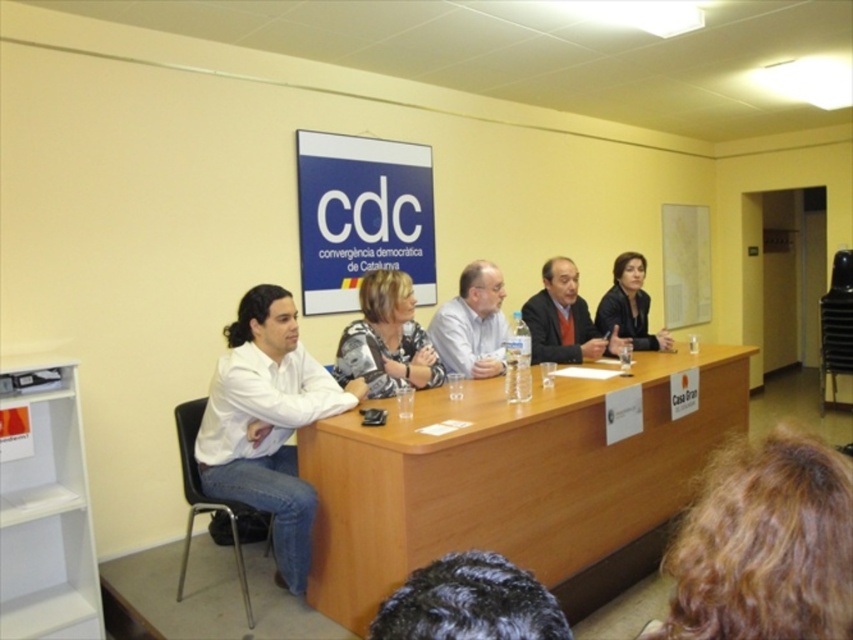
Question: Is dark curly hair at center to the right of patterned fabric blouse at center from the viewer's perspective?

Choices:
 (A) yes
 (B) no

Answer: (A)

Question: Which point is closer to the camera?

Choices:
 (A) dark curly hair at center
 (B) blonde curly hair at lower right
 (C) light brown wood table at center
 (D) black leather jacket at center

Answer: (A)

Question: Which object is closer to the camera taking this photo?

Choices:
 (A) black leather jacket at center
 (B) dark curly hair at center
 (C) light brown wood table at center
 (D) blonde curly hair at lower right

Answer: (B)

Question: Considering the real-world distances, which object is closest to the black leather jacket at center?

Choices:
 (A) light brown wood table at center
 (B) dark curly hair at center
 (C) blonde curly hair at lower right
 (D) white shirt at left

Answer: (A)

Question: Can you confirm if white shirt at center is bigger than matte orange shirt at center?

Choices:
 (A) no
 (B) yes

Answer: (A)

Question: Does matte orange shirt at center appear over black leather jacket at center?

Choices:
 (A) no
 (B) yes

Answer: (B)